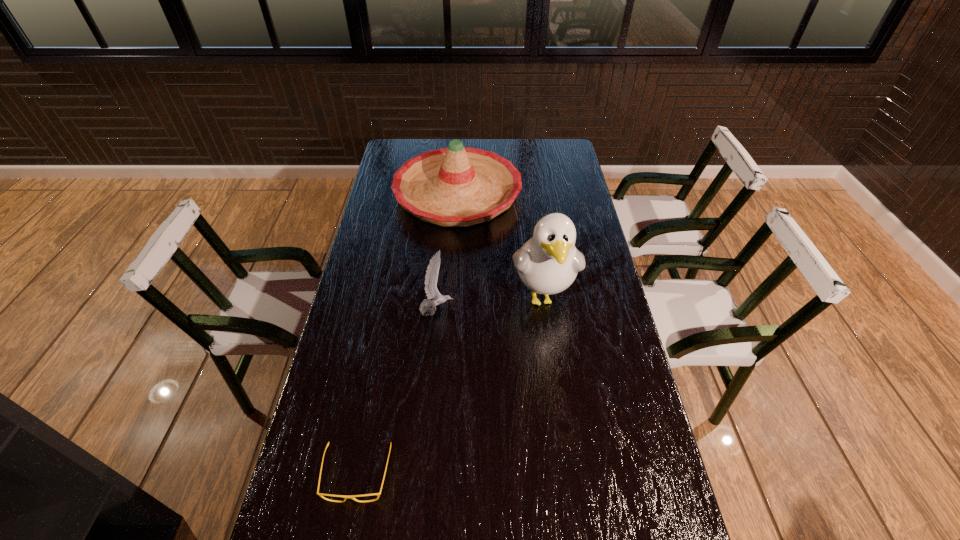
Find the location of a particular element. the right gull is located at coordinates (548, 263).

Find the location of `the tallest object`. the tallest object is located at coordinates (548, 263).

Locate an element on the screen. the farthest object is located at coordinates (457, 186).

I want to click on sombrero, so click(x=457, y=186).

The height and width of the screenshot is (540, 960). In order to click on the third tallest object in this screenshot , I will do `click(431, 276)`.

The image size is (960, 540). Identify the location of the shorter gull. (431, 276).

You are a GUI agent. You are given a task and a screenshot of the screen. Output one action in this format:
    pyautogui.click(x=<x>, y=<y>)
    Task: Click on the shortest object
    The image size is (960, 540).
    Given the screenshot: What is the action you would take?
    pyautogui.click(x=320, y=494)

You are a GUI agent. You are given a task and a screenshot of the screen. Output one action in this format:
    pyautogui.click(x=<x>, y=<y>)
    Task: Click on the nearest object
    The image size is (960, 540).
    Given the screenshot: What is the action you would take?
    pyautogui.click(x=320, y=494)

Where is `vacant space located 0.130m on the beak of the tallest object`? The width and height of the screenshot is (960, 540). vacant space located 0.130m on the beak of the tallest object is located at coordinates (552, 366).

Where is `free point located 0.160m on the front of the third shortest object`? free point located 0.160m on the front of the third shortest object is located at coordinates (453, 264).